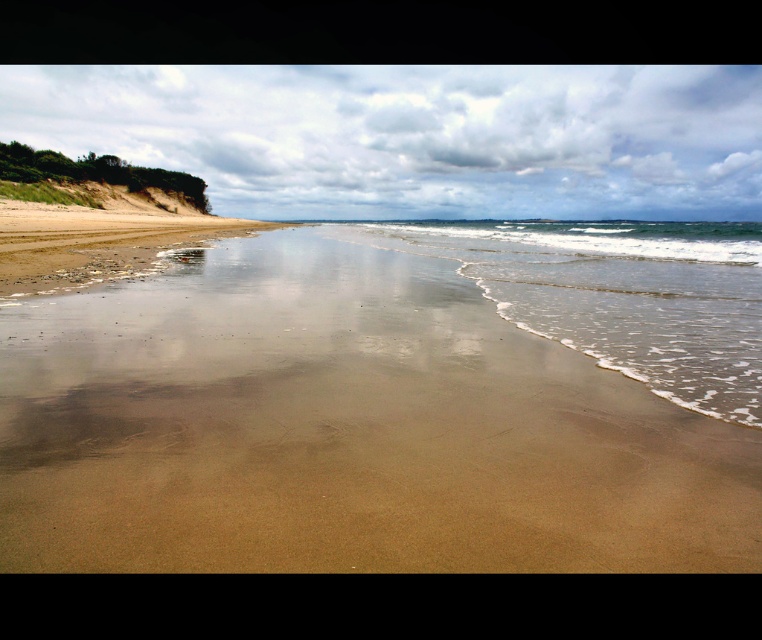
You are standing on the beach and want to walk to the water. Which direction should you go from the brown sandy beach at left to reach the clear water at lower center?

To reach the clear water at lower center from the brown sandy beach at left, you should walk towards the right since the clear water at lower center is positioned to the right of the brown sandy beach at left.

You are standing on the beach and want to walk from the smooth sand at center to the clear water at lower center. Which direction should you move to reach the water?

You should move forward because the smooth sand at center is closer to the viewer than the clear water at lower center, so moving towards the water would require going towards the lower part of the scene.